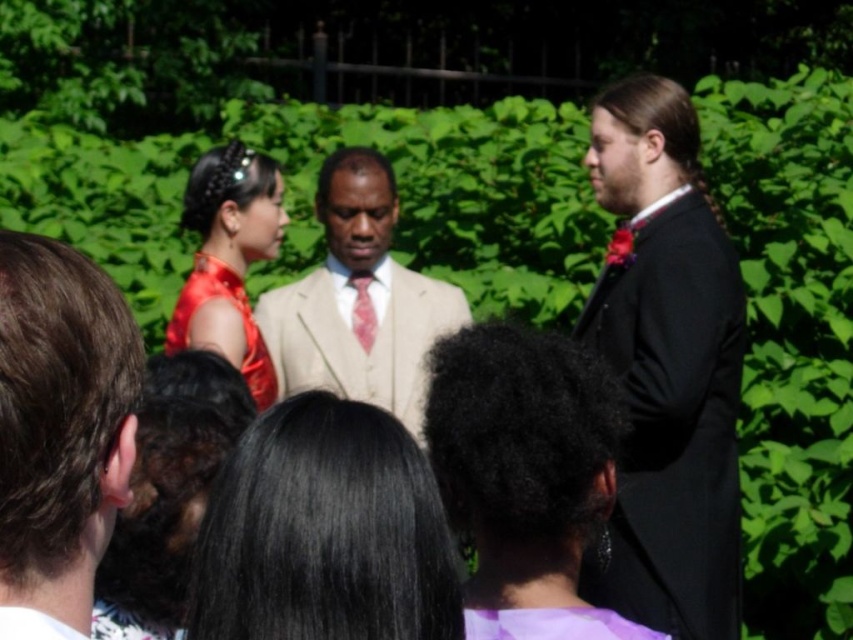
Question: Can you confirm if beige fabric suit at center is wider than pink satin tie at center?

Choices:
 (A) no
 (B) yes

Answer: (B)

Question: Is brown hair at left positioned before beige fabric suit at center?

Choices:
 (A) yes
 (B) no

Answer: (A)

Question: Based on their relative distances, which object is farther from the brown hair at left?

Choices:
 (A) purple satin hair at center
 (B) shiny red dress at center
 (C) black satin suit at right

Answer: (B)

Question: Estimate the real-world distances between objects in this image. Which object is closer to the black silky hair at center?

Choices:
 (A) brown hair at left
 (B) purple satin hair at center

Answer: (A)

Question: Is black satin suit at right in front of beige fabric suit at center?

Choices:
 (A) yes
 (B) no

Answer: (A)

Question: Which of these objects is positioned farthest from the shiny red dress at center?

Choices:
 (A) purple satin hair at center
 (B) beige fabric suit at center
 (C) black satin suit at right

Answer: (A)